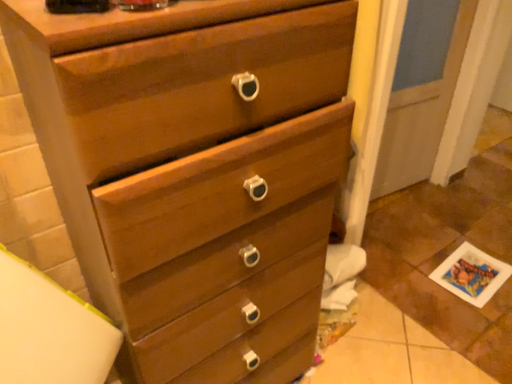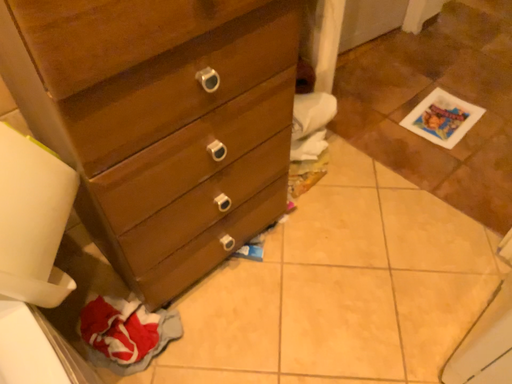
Question: Which way did the camera rotate in the video?

Choices:
 (A) rotated downward
 (B) rotated upward

Answer: (A)